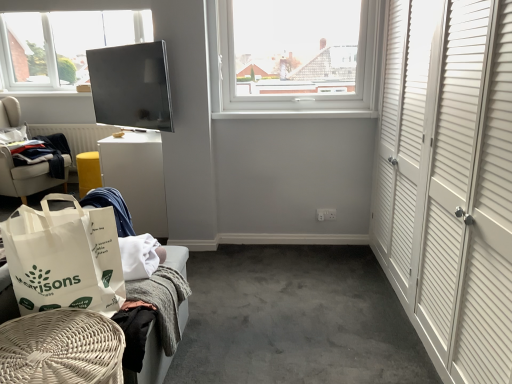
Question: From the image's perspective, is matte black tv at upper center over white plastic window at upper center?

Choices:
 (A) yes
 (B) no

Answer: (B)

Question: Is white plastic window at upper center a part of matte black tv at upper center?

Choices:
 (A) no
 (B) yes

Answer: (A)

Question: Can you confirm if matte black tv at upper center is thinner than white plastic window at upper center?

Choices:
 (A) yes
 (B) no

Answer: (A)

Question: Is matte black tv at upper center outside white plastic window at upper center?

Choices:
 (A) no
 (B) yes

Answer: (B)

Question: Is matte black tv at upper center wider than white plastic window at upper center?

Choices:
 (A) no
 (B) yes

Answer: (A)

Question: Does matte black tv at upper center come behind white plastic window at upper center?

Choices:
 (A) no
 (B) yes

Answer: (A)

Question: From the image's perspective, is white fabric chair at left, the third furniture in the front-to-back sequence, located above white wicker basket at lower left, which is the first furniture in bottom-to-top order?

Choices:
 (A) no
 (B) yes

Answer: (B)

Question: Is white fabric chair at left, which ranks as the third furniture in right-to-left order, not within white wicker basket at lower left, acting as the third furniture starting from the back?

Choices:
 (A) yes
 (B) no

Answer: (A)

Question: Does white fabric chair at left, which appears as the first furniture when viewed from the top, have a lesser height compared to white wicker basket at lower left, the 1th furniture in the right-to-left sequence?

Choices:
 (A) yes
 (B) no

Answer: (B)

Question: Can you confirm if white fabric chair at left, which appears as the 1th furniture when viewed from the back, is wider than white wicker basket at lower left, acting as the third furniture starting from the back?

Choices:
 (A) no
 (B) yes

Answer: (B)

Question: Considering the relative sizes of white fabric chair at left, the third furniture in the front-to-back sequence, and white wicker basket at lower left, which is counted as the first furniture, starting from the front, in the image provided, is white fabric chair at left, the third furniture in the front-to-back sequence, bigger than white wicker basket at lower left, which is counted as the first furniture, starting from the front,?

Choices:
 (A) no
 (B) yes

Answer: (B)

Question: Can you confirm if white fabric chair at left, which appears as the 1th furniture when viewed from the back, is thinner than white wicker basket at lower left, which is the first furniture in bottom-to-top order?

Choices:
 (A) yes
 (B) no

Answer: (B)

Question: From the image's perspective, would you say white wicker basket at lower left, which is the third furniture in top-to-bottom order, is shown under white paper bag at lower left?

Choices:
 (A) yes
 (B) no

Answer: (A)